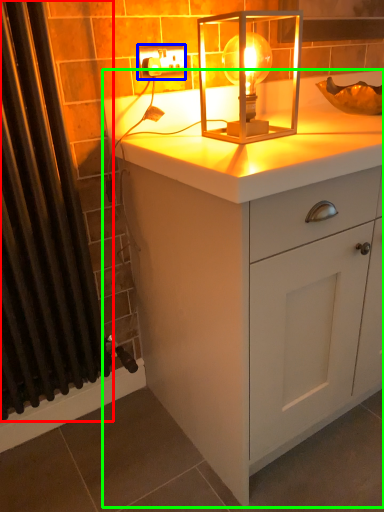
Question: Which is farther away from shower curtain (highlighted by a red box)? electric outlet (highlighted by a blue box) or chest of drawers (highlighted by a green box)?

Choices:
 (A) electric outlet
 (B) chest of drawers

Answer: (A)